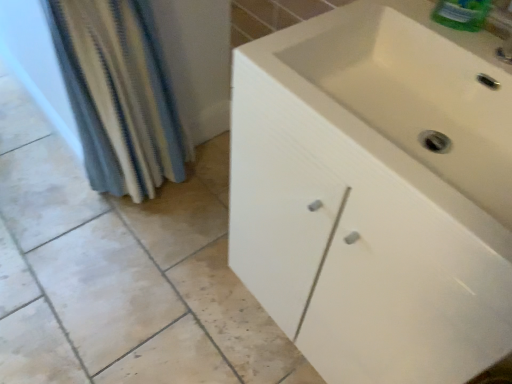
In order to click on vacant space situated on the left part of white matte cabinet at center in this screenshot , I will do `click(186, 300)`.